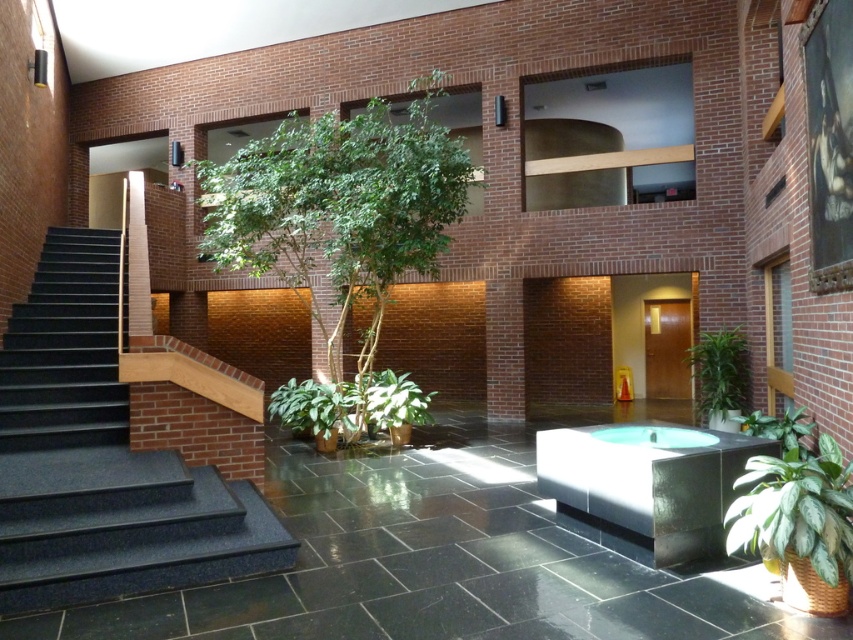
You are a visitor in the atrium and want to take a photo of the polished stainless steel jacuzzi at center and the green glossy plant at right. Which object will appear taller in the photo?

The green glossy plant at right will appear taller in the photo because it has a greater height than the polished stainless steel jacuzzi at center.

You are standing in the atrium and want to take a photo of the point at coordinates (537, 486). If your camera has a maximum focus range of 5 meters, will it be able to focus on that point?

The distance of point (537, 486) from the camera is 4.91 meters, which is within the camera maximum focus range of 5 meters. Therefore, the camera can focus on that point.

You are a visitor in this atrium and want to take a photo of both the green glossy plant at right and the green leafy plant at lower right. Which plant should you focus on first if you want to include both in your frame without moving your camera?

The green glossy plant at right is much taller than the green leafy plant at lower right, so you should focus on the taller green glossy plant at right first to ensure both are in frame.